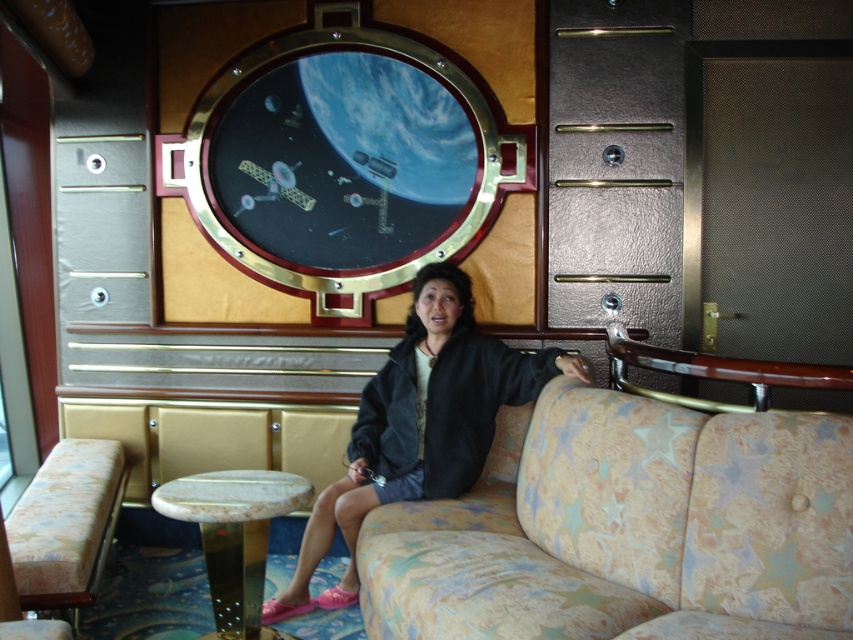
Does beige star-patterned fabric couch at center have a smaller size compared to black soft fabric robe at center?

No, beige star-patterned fabric couch at center is not smaller than black soft fabric robe at center.

Between beige star-patterned fabric couch at center and black soft fabric robe at center, which one has less height?

With less height is black soft fabric robe at center.

You are a GUI agent. You are given a task and a screenshot of the screen. Output one action in this format:
    pyautogui.click(x=<x>, y=<y>)
    Task: Click on the beige star-patterned fabric couch at center
    
    Given the screenshot: What is the action you would take?
    pyautogui.click(x=625, y=528)

Is beige fabric stool at lower left in front of white marble stool at lower center?

Yes, beige fabric stool at lower left is closer to the viewer.

This screenshot has width=853, height=640. What do you see at coordinates (67, 524) in the screenshot? I see `beige fabric stool at lower left` at bounding box center [67, 524].

Between point (67, 602) and point (258, 561), which one is positioned in front?

Positioned in front is point (67, 602).

The image size is (853, 640). I want to click on beige fabric stool at lower left, so click(x=67, y=524).

Between black soft fabric robe at center and beige fabric stool at lower left, which one has more height?

black soft fabric robe at center is taller.

Who is positioned more to the left, black soft fabric robe at center or beige fabric stool at lower left?

Positioned to the left is beige fabric stool at lower left.

Between point (397, 342) and point (61, 484), which one is positioned behind?

The point (397, 342) is behind.

Find the location of a particular element. The width and height of the screenshot is (853, 640). black soft fabric robe at center is located at coordinates (444, 408).